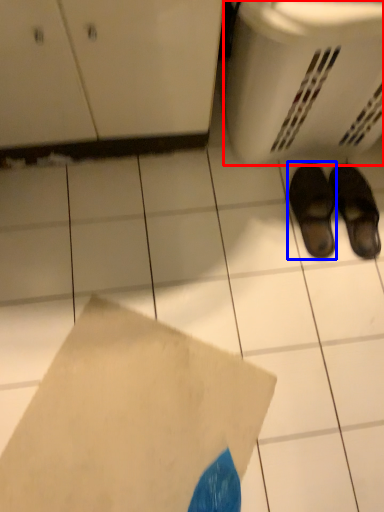
Question: Which object appears farthest to the camera in this image, basket (highlighted by a red box) or footwear (highlighted by a blue box)?

Choices:
 (A) basket
 (B) footwear

Answer: (B)